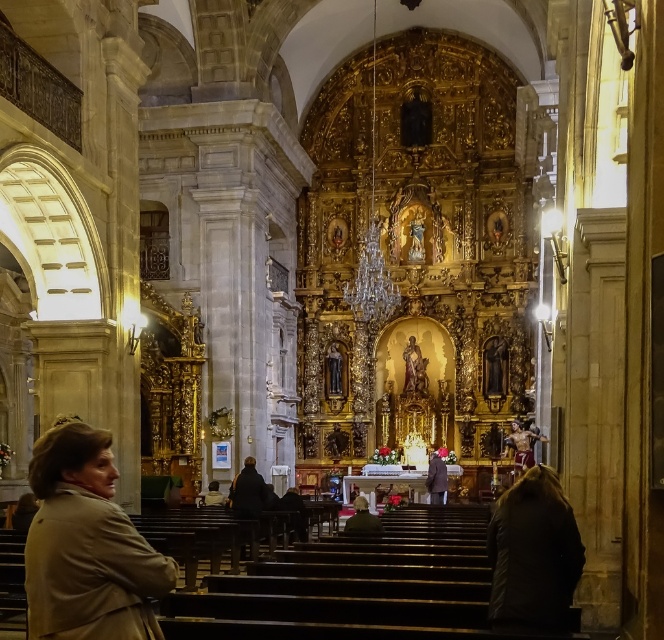
In the scene shown: Who is positioned more to the right, dark brown leather jacket at center or dark brown leather coat at center?

From the viewer's perspective, dark brown leather coat at center appears more on the right side.

Can you confirm if dark brown leather jacket at center is positioned below dark brown leather coat at center?

No, dark brown leather jacket at center is not below dark brown leather coat at center.

This screenshot has width=664, height=640. Describe the element at coordinates (363, 518) in the screenshot. I see `dark brown leather jacket at center` at that location.

Image resolution: width=664 pixels, height=640 pixels. In order to click on dark brown leather jacket at center in this screenshot , I will do `click(363, 518)`.

Is beige fabric coat at lower left smaller than dark brown leather jacket at center?

No.

Is point (27, 538) less distant than point (363, 496)?

Yes, point (27, 538) is in front of point (363, 496).

Who is more distant from viewer, (50, 637) or (363, 499)?

The point (363, 499) is more distant.

Identify the location of beige fabric coat at lower left. (86, 545).

Measure the distance between point (27, 557) and camera.

Point (27, 557) is 33.26 meters from camera.

Is beige fabric coat at lower left closer to camera compared to dark brown leather coat at center?

Yes, beige fabric coat at lower left is in front of dark brown leather coat at center.

What do you see at coordinates (86, 545) in the screenshot? I see `beige fabric coat at lower left` at bounding box center [86, 545].

Find the location of a particular element. beige fabric coat at lower left is located at coordinates (86, 545).